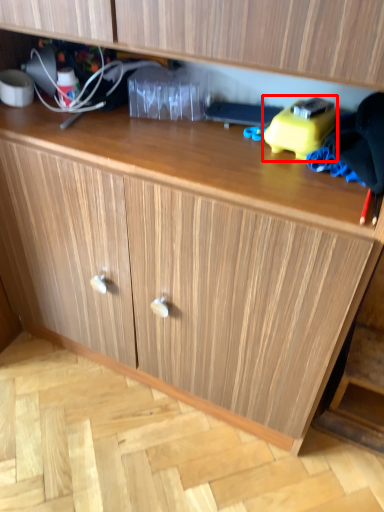
Question: From the image's perspective, what is the correct spatial positioning of toy (annotated by the red box) in reference to clothing?

Choices:
 (A) above
 (B) below

Answer: (A)